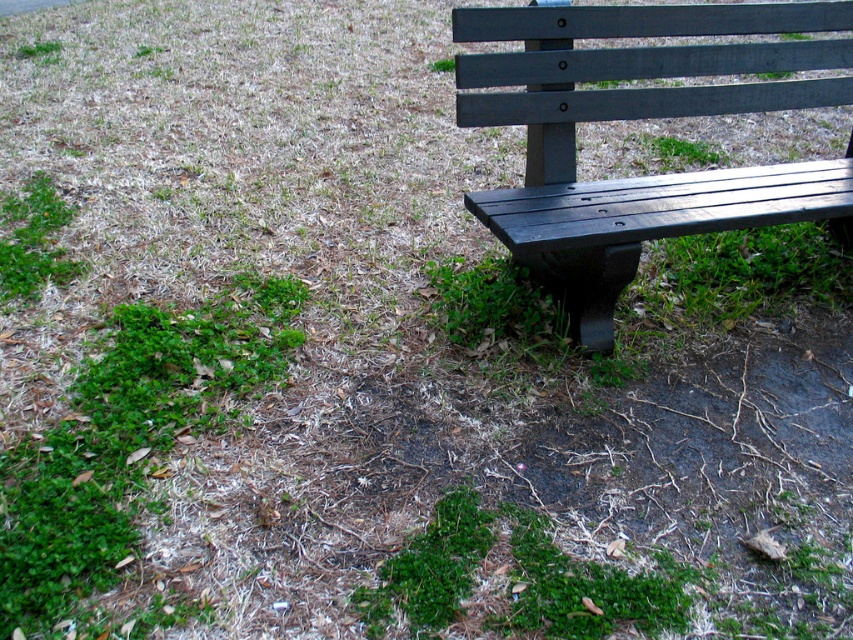
You are standing at the center of the park and see the matte black bench at right and the green leafy grass at lower left. Which object is positioned to the right side of the other?

The matte black bench at right is to the right of green leafy grass at lower left.